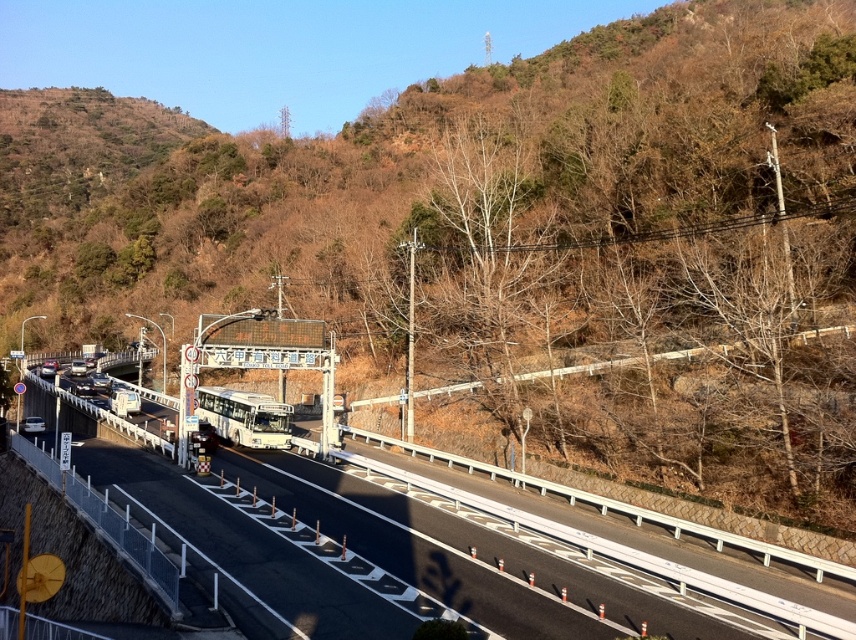
Question: Is brown leafy hillside at upper center wider than white matte bus at center?

Choices:
 (A) no
 (B) yes

Answer: (B)

Question: Which point is farther to the camera?

Choices:
 (A) (544, 525)
 (B) (259, 413)
 (C) (724, 115)

Answer: (C)

Question: Is brown leafy hillside at upper center bigger than white asphalt highway at center?

Choices:
 (A) no
 (B) yes

Answer: (B)

Question: Which point appears closest to the camera in this image?

Choices:
 (A) (745, 604)
 (B) (223, 412)

Answer: (A)

Question: Can you confirm if brown leafy hillside at upper center is positioned to the left of white matte bus at center?

Choices:
 (A) no
 (B) yes

Answer: (B)

Question: Which object is the closest to the white matte bus at center?

Choices:
 (A) white asphalt highway at center
 (B) brown leafy hillside at upper center

Answer: (A)